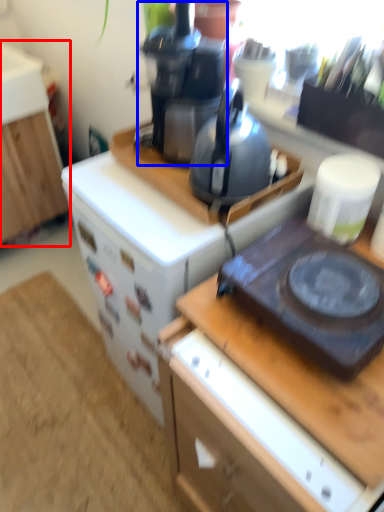
Question: Which object is closer to the camera taking this photo, cabinetry (highlighted by a red box) or coffeepot (highlighted by a blue box)?

Choices:
 (A) cabinetry
 (B) coffeepot

Answer: (B)